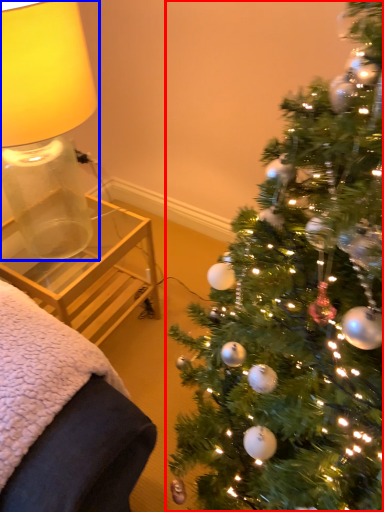
Question: Which point is closer to the camera, christmas tree (highlighted by a red box) or table lamp (highlighted by a blue box)?

Choices:
 (A) christmas tree
 (B) table lamp

Answer: (A)